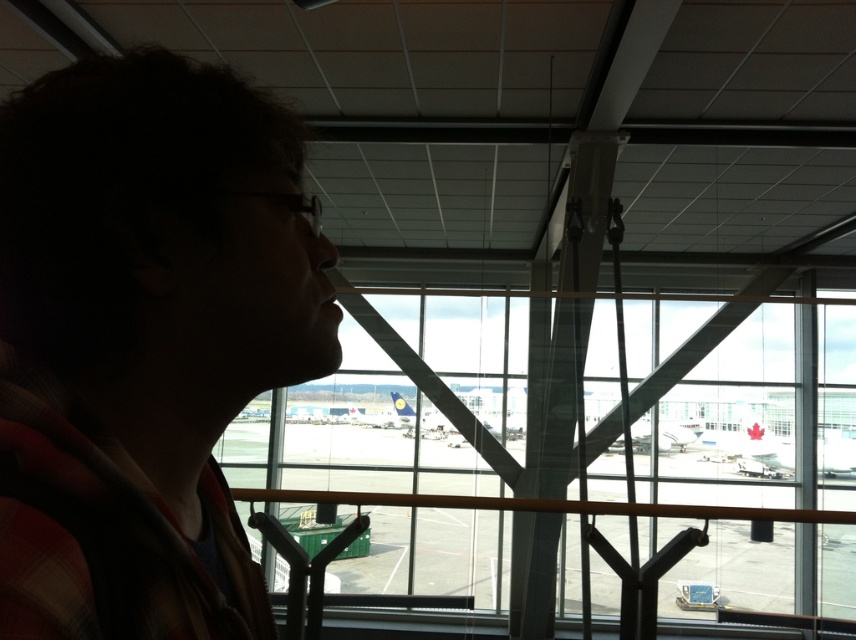
Question: Does plaid fabric at left appear under transparent glass window at center?

Choices:
 (A) no
 (B) yes

Answer: (A)

Question: Does plaid fabric at left have a larger size compared to transparent glass window at center?

Choices:
 (A) no
 (B) yes

Answer: (A)

Question: Considering the relative positions of plaid fabric at left and transparent glass window at center in the image provided, where is plaid fabric at left located with respect to transparent glass window at center?

Choices:
 (A) above
 (B) below

Answer: (A)

Question: Which object is farther from the camera taking this photo?

Choices:
 (A) plaid fabric at left
 (B) transparent glass window at center

Answer: (B)